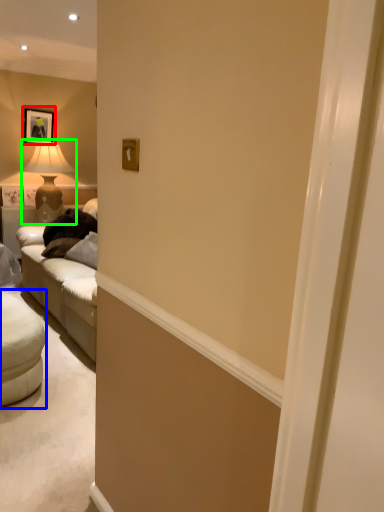
Question: Which object is the closest to the picture frame (highlighted by a red box)? Choose among these: studio couch (highlighted by a blue box) or table lamp (highlighted by a green box).

Choices:
 (A) studio couch
 (B) table lamp

Answer: (B)